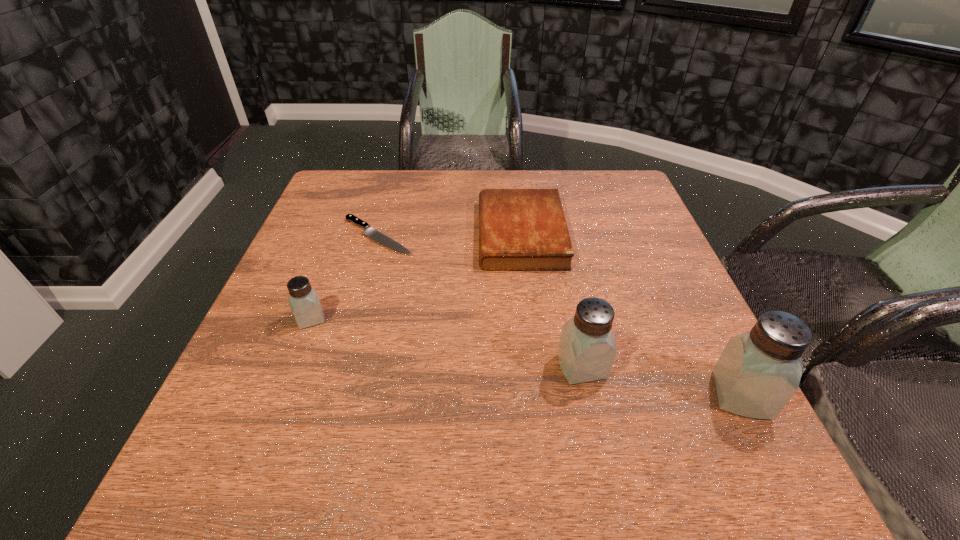
Locate an element on the screen. This screenshot has height=540, width=960. the leftmost saltshaker is located at coordinates (304, 302).

Identify the location of the third shortest object. Image resolution: width=960 pixels, height=540 pixels. (304, 302).

At what (x,y) coordinates should I click in order to perform the action: click on the second tallest saltshaker. Please return your answer as a coordinate pair (x, y). The image size is (960, 540). Looking at the image, I should click on (587, 348).

This screenshot has height=540, width=960. What are the coordinates of `the second saltshaker from right to left` in the screenshot? It's located at (587, 348).

Find the location of a particular element. the rightmost object is located at coordinates (758, 372).

This screenshot has height=540, width=960. I want to click on the fourth tallest object, so click(x=519, y=229).

Find the location of a particular element. the shortest object is located at coordinates (374, 234).

Find the location of a particular element. vacant space located 0.370m on the back of the third nearest object is located at coordinates (353, 210).

Where is `vacant space located 0.120m on the right of the fourth shortest object`? vacant space located 0.120m on the right of the fourth shortest object is located at coordinates (670, 367).

Where is `vacant space located 0.170m on the left of the rightmost object`? vacant space located 0.170m on the left of the rightmost object is located at coordinates (613, 395).